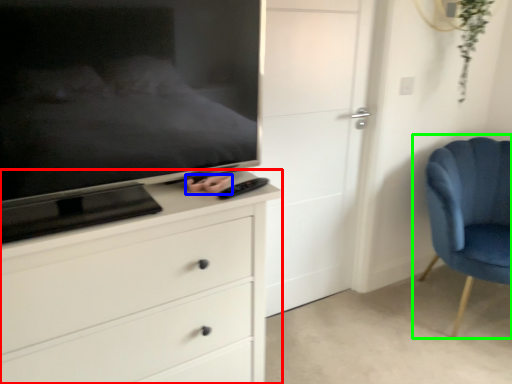
Question: Considering the real-world distances, which object is farthest from chest of drawers (highlighted by a red box)? hand (highlighted by a blue box) or chair (highlighted by a green box)?

Choices:
 (A) hand
 (B) chair

Answer: (B)